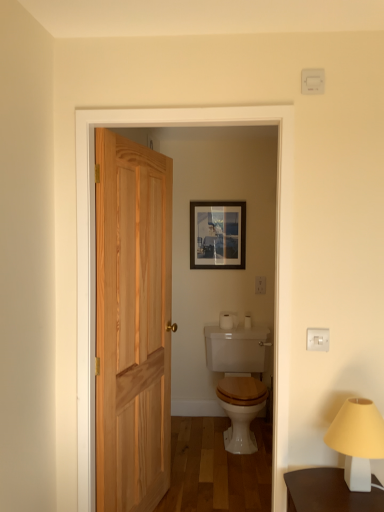
Question: Is white matte toilet paper at center further to the viewer compared to white glossy toilet at center?

Choices:
 (A) no
 (B) yes

Answer: (B)

Question: Is white matte toilet paper at center to the right of white glossy toilet at center from the viewer's perspective?

Choices:
 (A) no
 (B) yes

Answer: (A)

Question: From the image's perspective, does white matte toilet paper at center appear higher than white glossy toilet at center?

Choices:
 (A) yes
 (B) no

Answer: (A)

Question: Is white matte toilet paper at center bigger than white glossy toilet at center?

Choices:
 (A) yes
 (B) no

Answer: (B)

Question: Considering the relative sizes of white matte toilet paper at center and white glossy toilet at center in the image provided, is white matte toilet paper at center thinner than white glossy toilet at center?

Choices:
 (A) no
 (B) yes

Answer: (B)

Question: From their relative heights in the image, would you say matte glass picture frame at center is taller or shorter than white matte table lamp at lower right?

Choices:
 (A) short
 (B) tall

Answer: (B)

Question: Looking at the image, does matte glass picture frame at center seem bigger or smaller compared to white matte table lamp at lower right?

Choices:
 (A) small
 (B) big

Answer: (A)

Question: Is point (200, 215) closer or farther from the camera than point (372, 403)?

Choices:
 (A) closer
 (B) farther

Answer: (B)

Question: From the image's perspective, relative to white matte table lamp at lower right, is matte glass picture frame at center above or below?

Choices:
 (A) below
 (B) above

Answer: (B)

Question: In terms of height, does natural wood screen door at center look taller or shorter compared to white matte table lamp at lower right?

Choices:
 (A) short
 (B) tall

Answer: (B)

Question: Considering the relative positions of natural wood screen door at center and white matte table lamp at lower right in the image provided, is natural wood screen door at center to the left or to the right of white matte table lamp at lower right?

Choices:
 (A) right
 (B) left

Answer: (B)

Question: From a real-world perspective, is natural wood screen door at center above or below white matte table lamp at lower right?

Choices:
 (A) below
 (B) above

Answer: (B)

Question: Based on their sizes in the image, would you say natural wood screen door at center is bigger or smaller than white matte table lamp at lower right?

Choices:
 (A) small
 (B) big

Answer: (B)

Question: Does point (241, 365) appear closer or farther from the camera than point (286, 328)?

Choices:
 (A) farther
 (B) closer

Answer: (A)

Question: In terms of width, does white glossy toilet at center look wider or thinner when compared to natural wood screen door at center?

Choices:
 (A) wide
 (B) thin

Answer: (A)